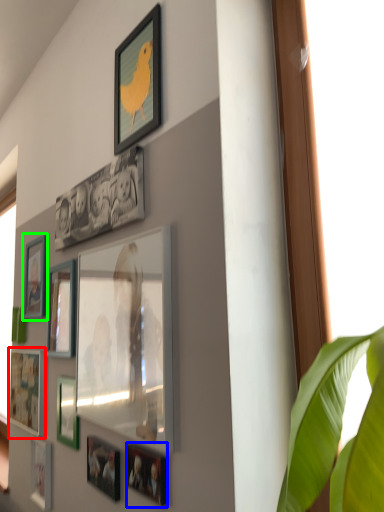
Question: Which is nearer to the picture frame (highlighted by a red box)? picture frame (highlighted by a blue box) or picture frame (highlighted by a green box).

Choices:
 (A) picture frame
 (B) picture frame

Answer: (B)